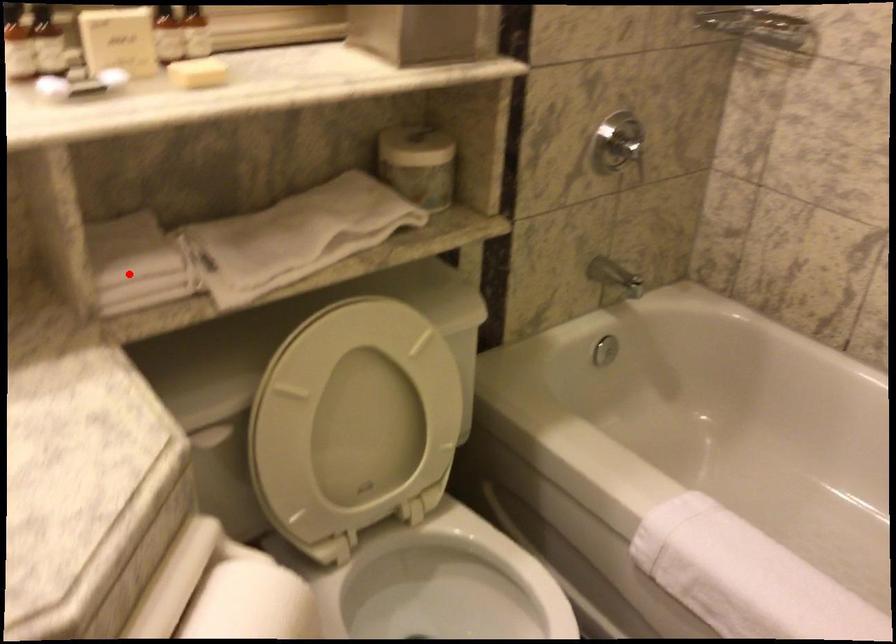
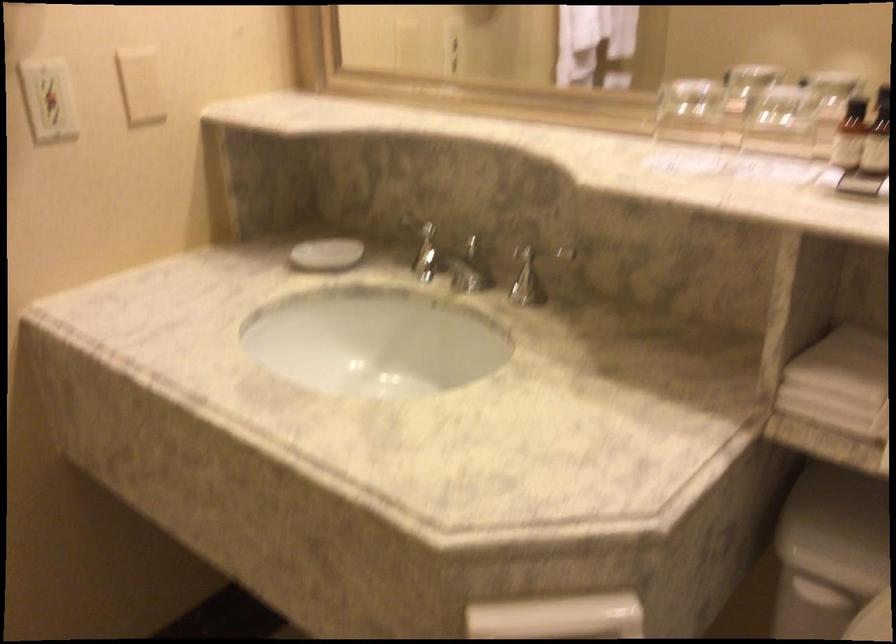
Locate, in the second image, the point that corresponds to the highlighted location in the first image.

(840, 383)